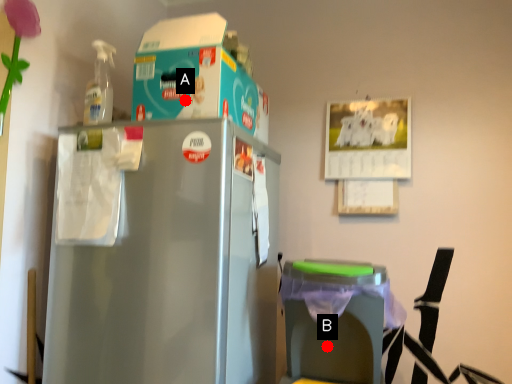
Question: Two points are circled on the image, labeled by A and B beside each circle. Which of the following is the farthest from the observer?

Choices:
 (A) A is further
 (B) B is further

Answer: (B)